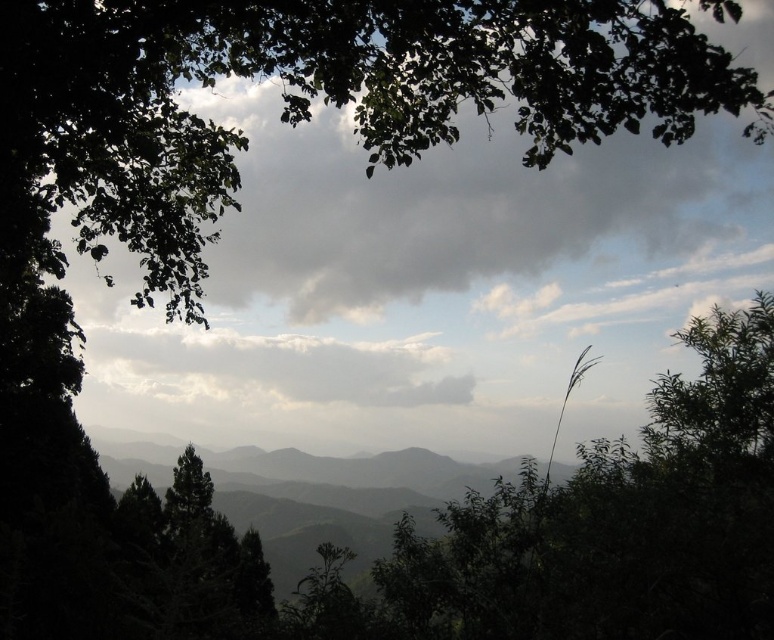
You are standing in a forest looking at the mountains. There is a point marked at coordinates (427, 209). What does this point indicate?

The point at (427, 209) marks the gray cloudy sky at upper center.

You are an airplane pilot flying through the gray cloudy sky at upper center and the white fluffy cloud at center. Which object is closer to your cockpit window?

The gray cloudy sky at upper center is closer to your cockpit window because it is in front of the white fluffy cloud at center.